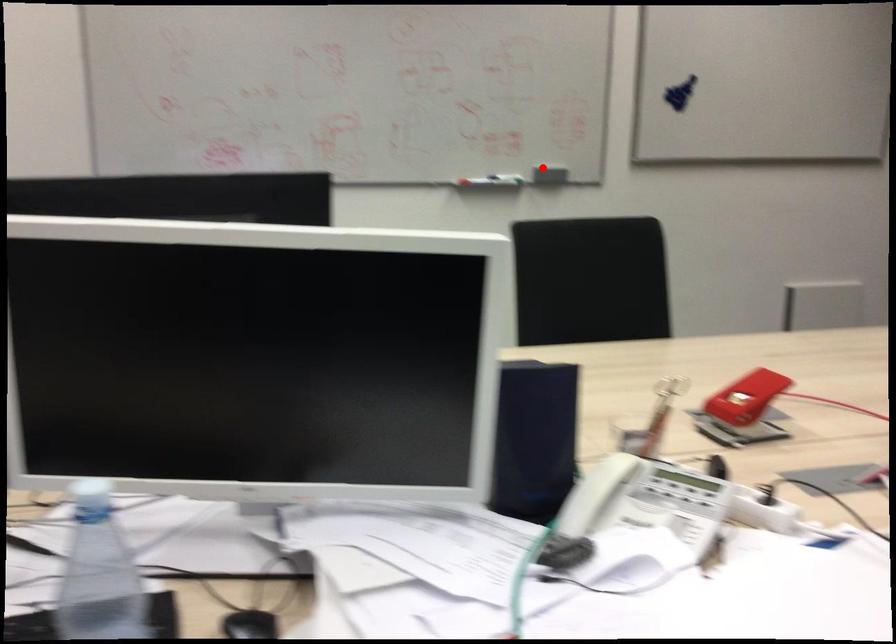
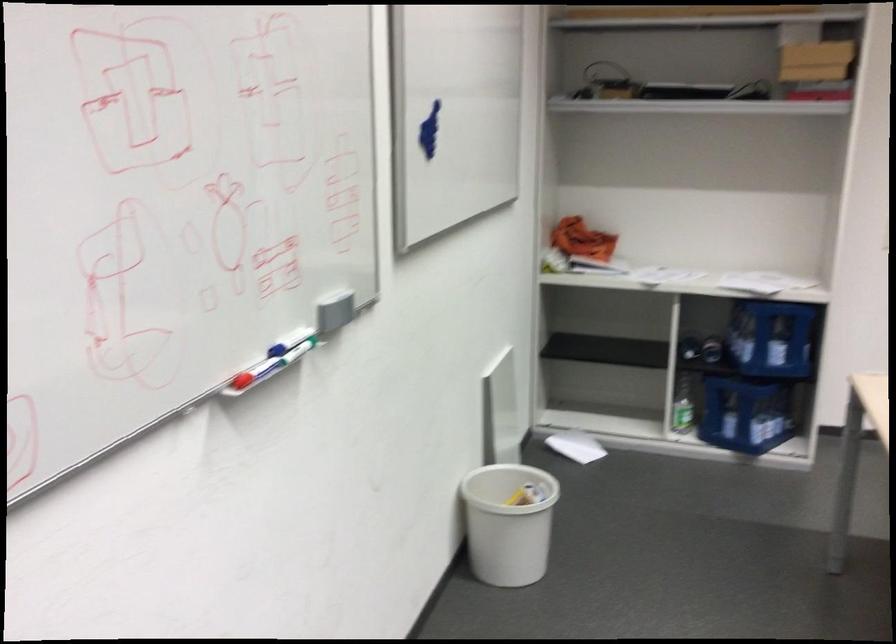
Find the pixel in the second image that matches the highlighted location in the first image.

(291, 337)